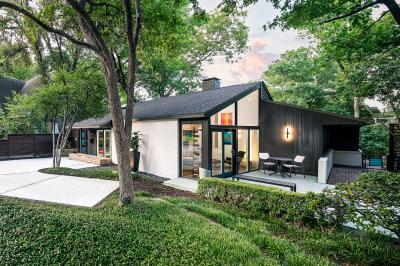
Where is `entrance`? Image resolution: width=400 pixels, height=266 pixels. entrance is located at coordinates (196, 144), (225, 154), (80, 140).